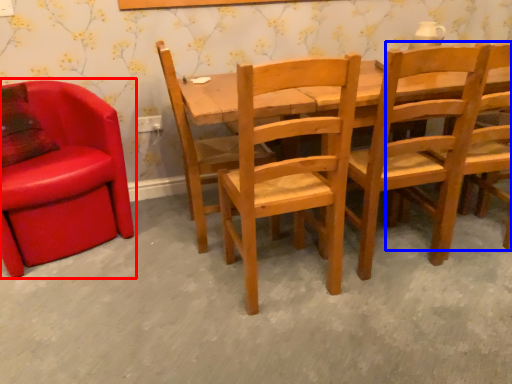
Question: Among these objects, which one is farthest to the camera, chair (highlighted by a red box) or chair (highlighted by a blue box)?

Choices:
 (A) chair
 (B) chair

Answer: (A)